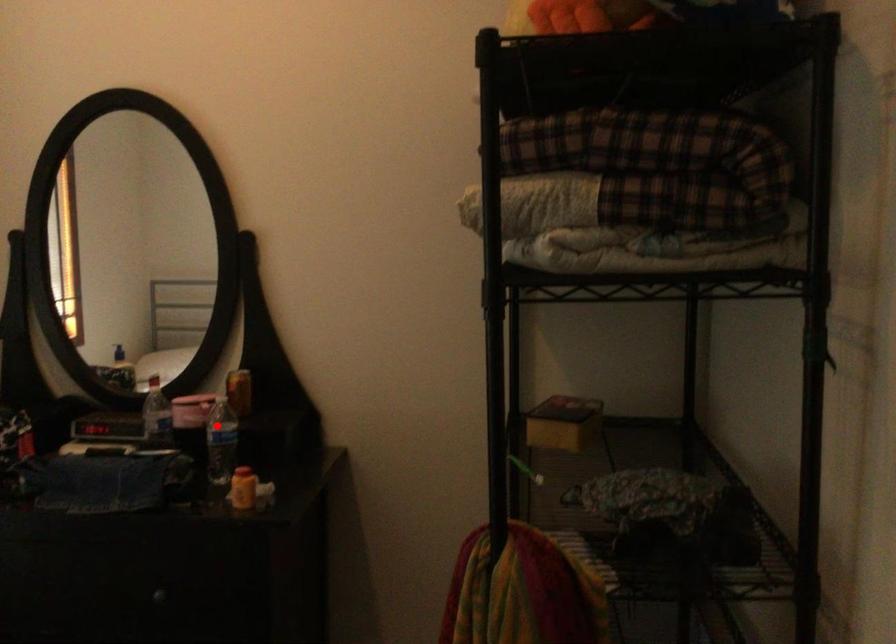
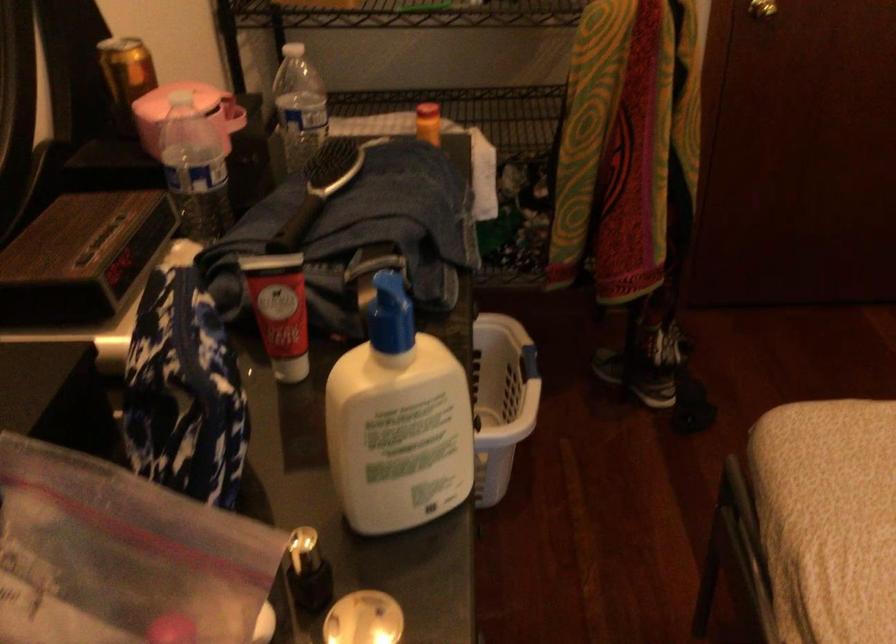
Find the pixel in the second image that matches the highlighted location in the first image.

(298, 106)